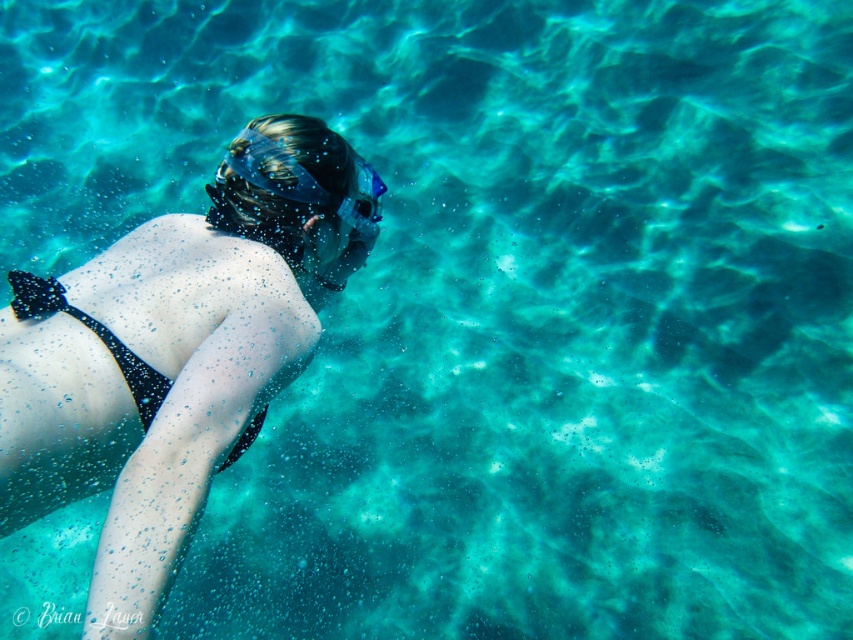
Measure the distance from matte black bikini at center to black matte bikini top at lower left.

matte black bikini at center is 6.43 inches from black matte bikini top at lower left.

Who is higher up, matte black bikini at center or black matte bikini top at lower left?

matte black bikini at center

Measure the distance between point (82, 292) and camera.

They are 4.64 feet apart.

The image size is (853, 640). Identify the location of matte black bikini at center. (175, 353).

Who is more distant from viewer, (x=331, y=257) or (x=242, y=150)?

The point (x=331, y=257) is behind.

Is matte black bikini at center behind transparent blue goggles at upper center?

No, matte black bikini at center is in front of transparent blue goggles at upper center.

Which is behind, point (122, 577) or point (306, 188)?

The point (306, 188) is behind.

Locate an element on the screen. The image size is (853, 640). matte black bikini at center is located at coordinates (175, 353).

The image size is (853, 640). What do you see at coordinates (310, 180) in the screenshot?
I see `transparent blue goggles at upper center` at bounding box center [310, 180].

Measure the distance between transparent blue goggles at upper center and camera.

The distance of transparent blue goggles at upper center from camera is 1.53 meters.

Locate an element on the screen. transparent blue goggles at upper center is located at coordinates (310, 180).